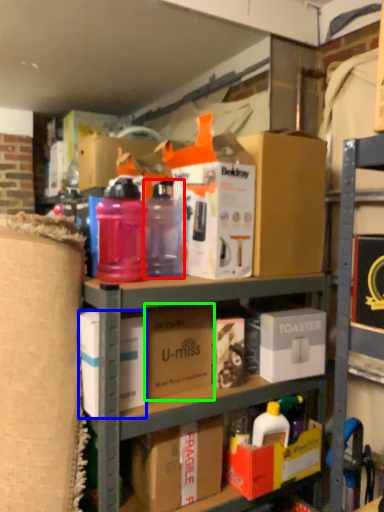
Question: Estimate the real-world distances between objects in this image. Which object is closer to bottle (highlighted by a red box), box (highlighted by a blue box) or cardboard box (highlighted by a green box)?

Choices:
 (A) box
 (B) cardboard box

Answer: (B)